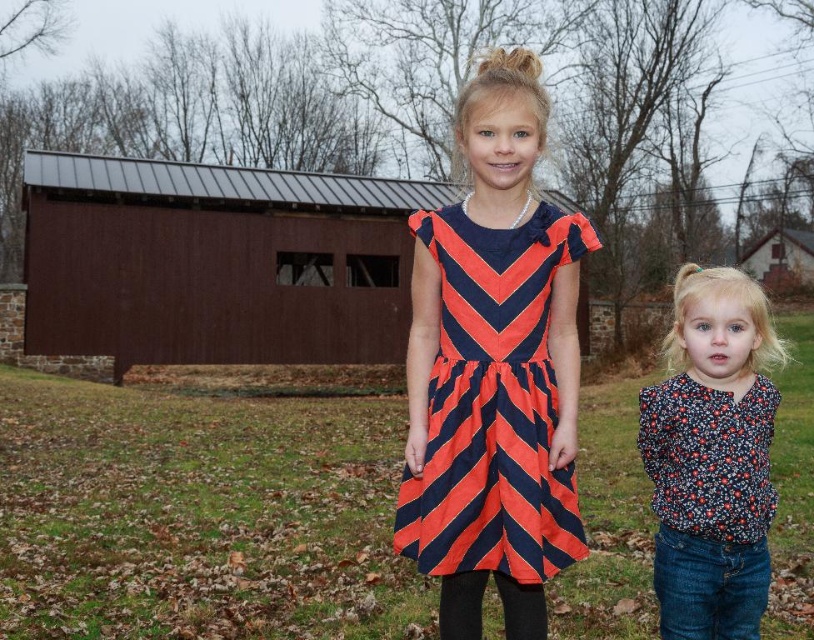
You are a photographer trying to capture both the brown wooden barn at center and the orange and navy striped dress at center in the same frame. Based on their sizes, which object should you focus on first to ensure both fit in the shot?

The brown wooden barn at center is taller than the orange and navy striped dress at center, so you should focus on the brown wooden barn at center first to ensure it fits in the frame before adjusting for the smaller dress.

You are a photographer trying to capture a photo of the orange and navy striped dress at center and the brown wooden barn at center. Which object should you focus on first if you want to ensure both are in focus?

The brown wooden barn at center is closer to the photographer than the orange and navy striped dress at center. To ensure both are in focus, you should focus on the brown wooden barn at center first since it is closer, and the depth of field may extend to the dress behind it.

You are standing at the point marked by the coordinates point (246,205). You want to walk straight towards the barn. How far will you have to walk to reach the barn?

The distance between point (246,205) and the viewer is 24.11 meters, so you will have to walk 24.11 meters to reach the barn.